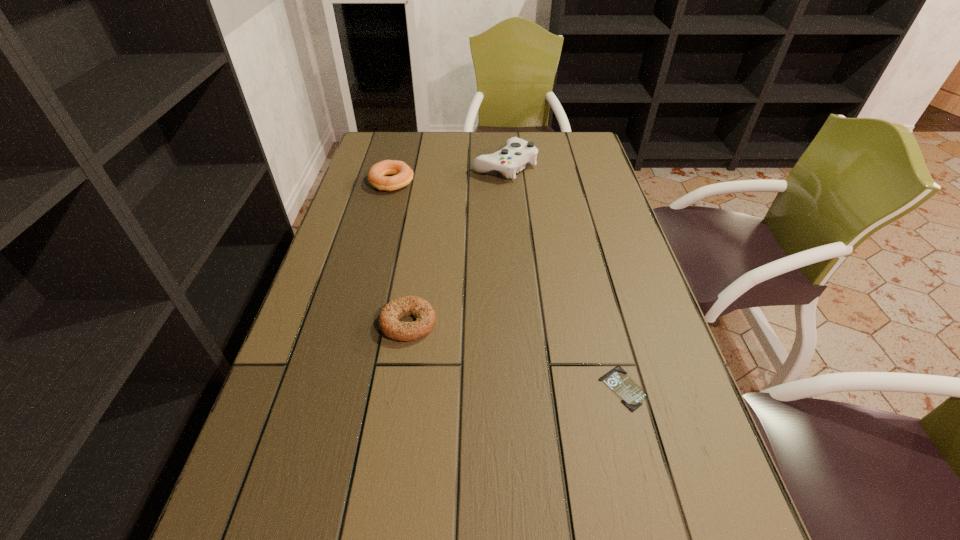
The height and width of the screenshot is (540, 960). I want to click on object that ranks as the third closest to the third shortest object, so click(x=631, y=394).

Locate an element on the screen. vacant space that satisfies the following two spatial constraints: 1. on the front side of the farther bagel; 2. on the left side of the identity card is located at coordinates (337, 388).

Locate an element on the screen. The height and width of the screenshot is (540, 960). blank space that satisfies the following two spatial constraints: 1. on the back side of the third tallest object; 2. on the left side of the control is located at coordinates (432, 166).

In order to click on vacant point that satisfies the following two spatial constraints: 1. on the back side of the control; 2. on the left side of the taller bagel in this screenshot , I will do `click(396, 166)`.